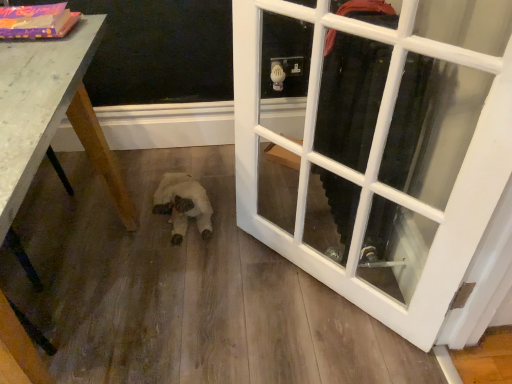
Locate an element on the screen. The height and width of the screenshot is (384, 512). vacant area that lies between white glass door at center and white plush toy at center is located at coordinates [x=257, y=258].